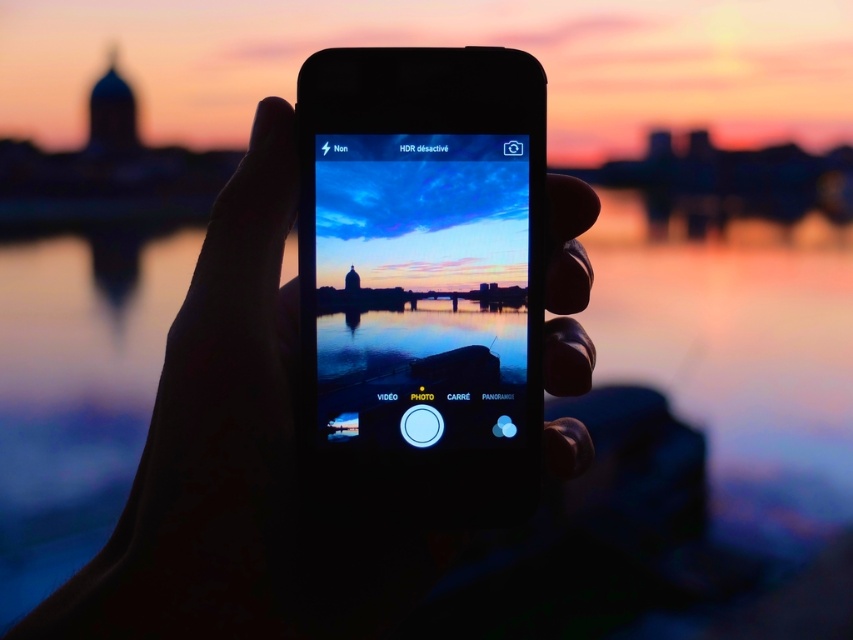
Question: Can you confirm if matte black smartphone at center is bigger than black matte hand at center?

Choices:
 (A) yes
 (B) no

Answer: (B)

Question: Which point is farther to the camera?

Choices:
 (A) black matte hand at center
 (B) matte black smartphone at center

Answer: (B)

Question: Does matte black smartphone at center appear over black matte hand at center?

Choices:
 (A) yes
 (B) no

Answer: (A)

Question: Observing the image, what is the correct spatial positioning of matte black smartphone at center in reference to black matte hand at center?

Choices:
 (A) left
 (B) right

Answer: (B)

Question: Among these objects, which one is farthest from the camera?

Choices:
 (A) matte black smartphone at center
 (B) black matte hand at center

Answer: (A)